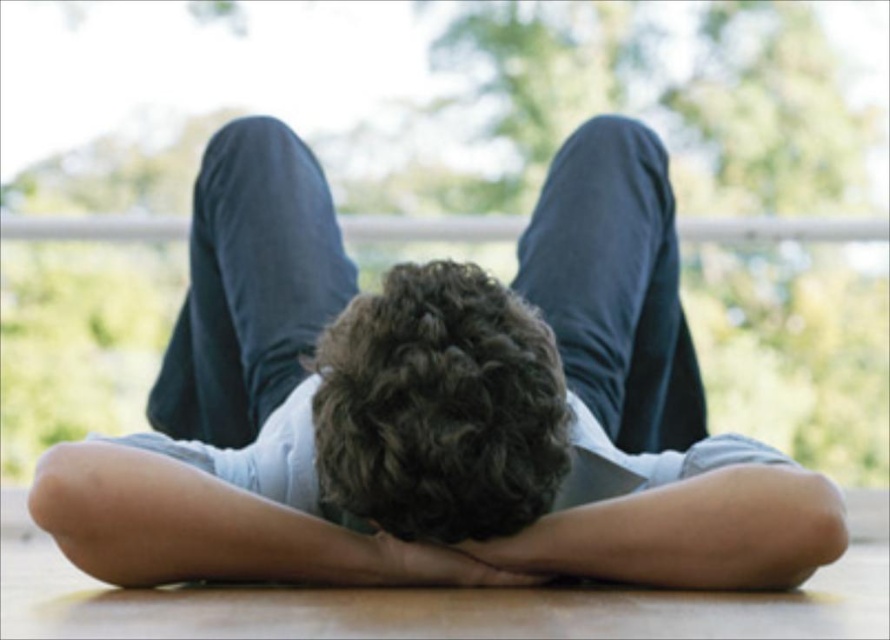
Does light blue denim shorts at center have a greater width compared to smooth skin hand at center?

Yes.

Based on the photo, is light blue denim shorts at center below smooth skin hand at center?

Actually, light blue denim shorts at center is above smooth skin hand at center.

This screenshot has height=640, width=890. In order to click on light blue denim shorts at center in this screenshot , I will do `click(435, 401)`.

Image resolution: width=890 pixels, height=640 pixels. What are the coordinates of `light blue denim shorts at center` in the screenshot? It's located at (435, 401).

Can you confirm if dark curly hair at center is thinner than smooth skin hand at center?

In fact, dark curly hair at center might be wider than smooth skin hand at center.

The image size is (890, 640). In order to click on dark curly hair at center in this screenshot , I will do `click(439, 406)`.

Is light blue denim shorts at center further to the viewer compared to dark curly hair at center?

Yes, it is.

Is light blue denim shorts at center thinner than dark curly hair at center?

Incorrect, light blue denim shorts at center's width is not less than dark curly hair at center's.

What do you see at coordinates (435, 401) in the screenshot? I see `light blue denim shorts at center` at bounding box center [435, 401].

This screenshot has width=890, height=640. I want to click on light blue denim shorts at center, so click(x=435, y=401).